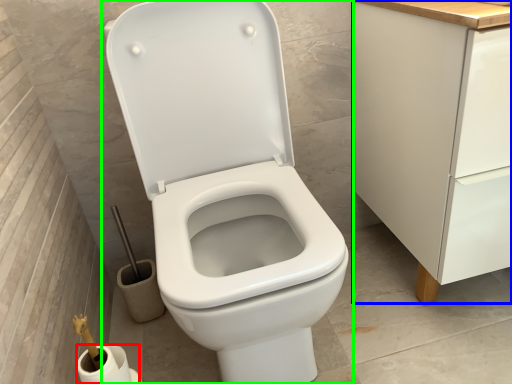
Question: Based on their relative distances, which object is nearer to toilet paper (highlighted by a red box)? Choose from cabinetry (highlighted by a blue box) and toilet (highlighted by a green box).

Choices:
 (A) cabinetry
 (B) toilet

Answer: (B)